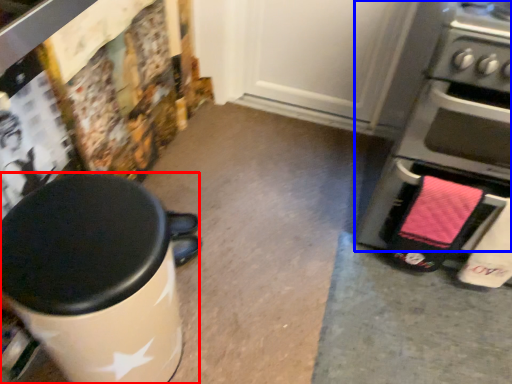
Question: Which object appears closest to the camera in this image, waste container (highlighted by a red box) or home appliance (highlighted by a blue box)?

Choices:
 (A) waste container
 (B) home appliance

Answer: (A)